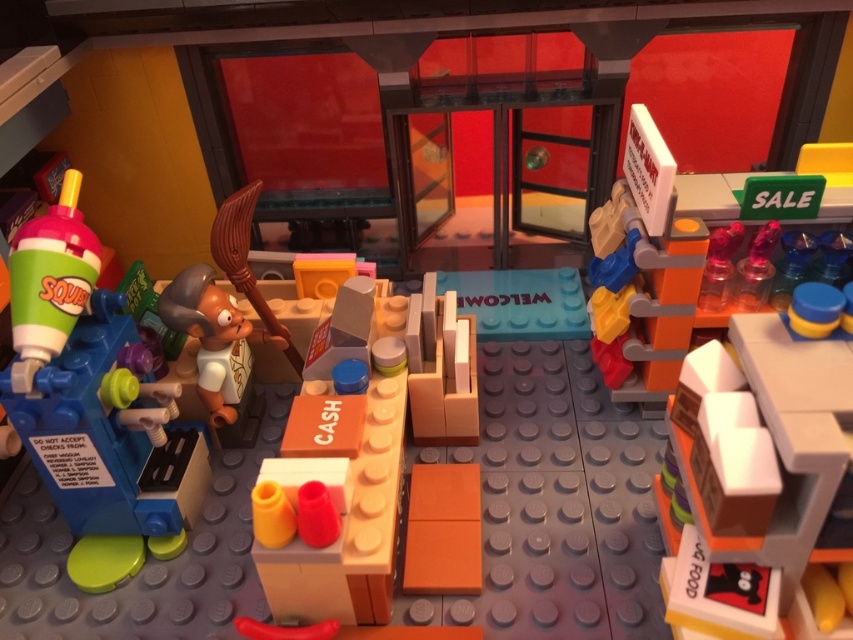
Does matte plastic soda machine at left appear under smooth brown figure at center-left?

Indeed, matte plastic soda machine at left is positioned under smooth brown figure at center-left.

Between matte plastic soda machine at left and smooth brown figure at center-left, which one appears on the right side from the viewer's perspective?

Positioned to the right is smooth brown figure at center-left.

I want to click on matte plastic soda machine at left, so click(93, 404).

Image resolution: width=853 pixels, height=640 pixels. I want to click on matte plastic soda machine at left, so click(x=93, y=404).

Is point (810, 342) in front of point (367, 461)?

That is True.

Who is taller, smooth white shelf at right or orange matte cash register at center?

orange matte cash register at center is taller.

Who is more forward, (730, 358) or (369, 524)?

Point (730, 358) is more forward.

Locate an element on the screen. The image size is (853, 640). smooth white shelf at right is located at coordinates (770, 435).

Between matte plastic soda machine at left and orange matte cash register at center, which one is positioned higher?

matte plastic soda machine at left is above.

Does matte plastic soda machine at left have a larger size compared to orange matte cash register at center?

Indeed, matte plastic soda machine at left has a larger size compared to orange matte cash register at center.

Image resolution: width=853 pixels, height=640 pixels. Identify the location of matte plastic soda machine at left. (93, 404).